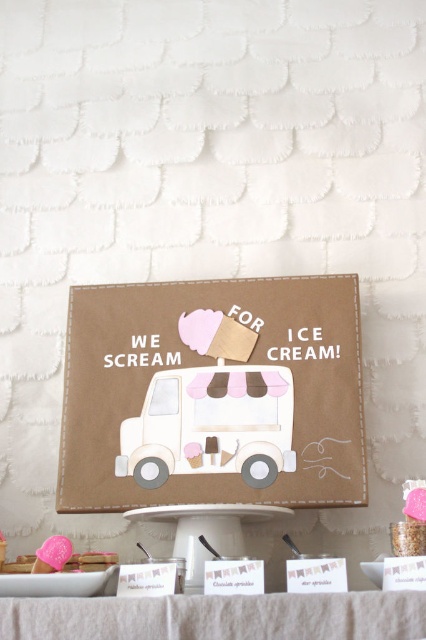
You are a guest at the event and want to take a photo of the brown paper ice cream truck at center and the white linen tablecloth at lower center. Which object should you focus on first to ensure both are in the frame?

You should focus on the brown paper ice cream truck at center first because it is closer to you than the white linen tablecloth at lower center, so adjusting the camera to capture it ensures the tablecloth will also be in view.

You are setting up for an ice cream party and need to place a decorative sign on a white pedestal stand. The sign has an ice cream truck illustration. Where should you place the sign relative to the white linen tablecloth at lower center?

The sign should be placed behind the white linen tablecloth at lower center since the tablecloth is located at point (218, 616), which is in front of the sign in the image.

You are setting up a dessert table and need to place both the white linen tablecloth at lower center and the pink frosted cookie at center. Which object should you place first to ensure proper positioning?

You should place the white linen tablecloth at lower center first because it is shorter than the pink frosted cookie at center, allowing you to position the taller cookie on top or in front without obstructing the tablecloth.